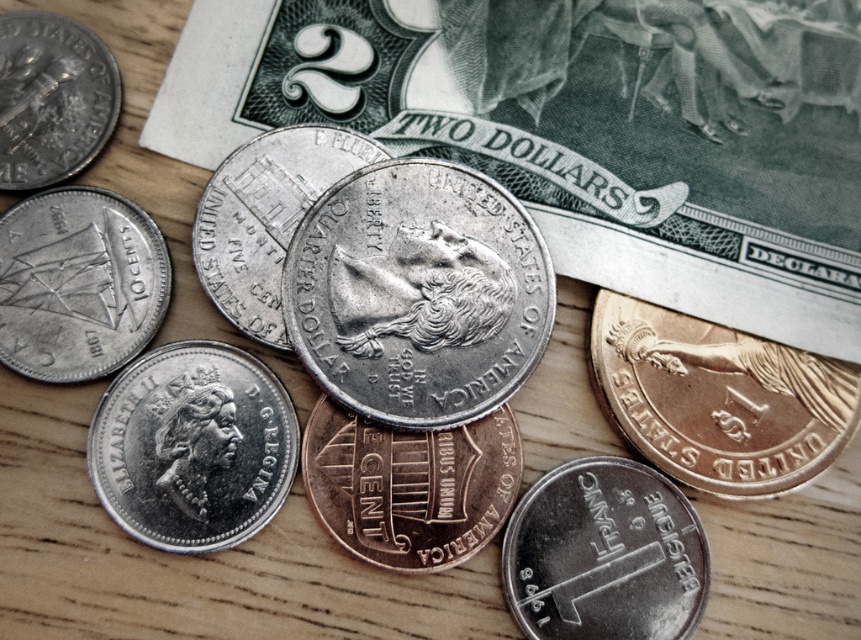
What do you see at coordinates (191, 445) in the screenshot? I see `silver metallic coin at lower left` at bounding box center [191, 445].

Is silver metallic coin at lower left thinner than copper/brass penny at center?

Yes.

Identify the location of silver metallic coin at lower left. (191, 445).

Is silver metallic coin at lower left thinner than shiny silver coin at upper left?

No, silver metallic coin at lower left is not thinner than shiny silver coin at upper left.

Who is more forward, (138,364) or (5,29)?

Positioned in front is point (138,364).

In order to click on silver metallic coin at lower left in this screenshot , I will do [191, 445].

Can you confirm if silver metallic coin at center is shorter than silver/metallic coin at left?

Yes.

Describe the element at coordinates (604, 554) in the screenshot. This screenshot has width=861, height=640. I see `silver metallic coin at center` at that location.

Identify the location of silver metallic coin at center. (604, 554).